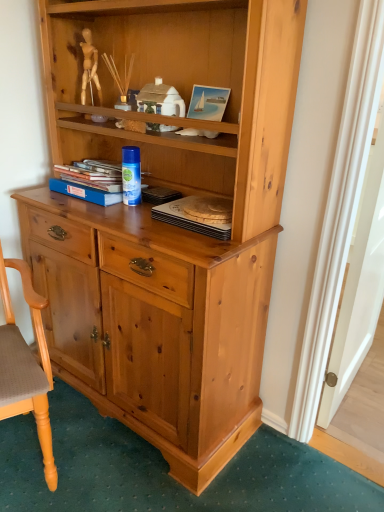
Measure the distance between blue hardcover book at center, which is the 1th book in left-to-right order, and camera.

blue hardcover book at center, which is the 1th book in left-to-right order, is 4.91 feet from camera.

Where is `wooden polished chair at lower left`? This screenshot has width=384, height=512. wooden polished chair at lower left is located at coordinates (26, 366).

Is wooden polished chair at lower left positioned beyond the bounds of blue hardcover book at center, which is the 1th book in left-to-right order?

Indeed, wooden polished chair at lower left is completely outside blue hardcover book at center, which is the 1th book in left-to-right order.

How many degrees apart are the facing directions of wooden polished chair at lower left and blue hardcover book at center, which is the 1th book in left-to-right order?

The angle between the facing direction of wooden polished chair at lower left and the facing direction of blue hardcover book at center, which is the 1th book in left-to-right order, is 68.4 degrees.

Is wooden polished chair at lower left not close to blue hardcover book at center, the 2th book positioned from the right?

No, wooden polished chair at lower left is not far away from blue hardcover book at center, the 2th book positioned from the right.

Considering the sizes of objects wooden polished chair at lower left and blue hardcover book at center, which is the 1th book in left-to-right order, in the image provided, who is wider, wooden polished chair at lower left or blue hardcover book at center, which is the 1th book in left-to-right order,?

wooden polished chair at lower left.

Which of these two, blue hardcover book at center, which is the 1th book in left-to-right order, or wooden round tray at center, the 1th book viewed from the right, stands taller?

blue hardcover book at center, which is the 1th book in left-to-right order.

From a real-world perspective, is blue hardcover book at center, which is the 1th book in left-to-right order, positioned under wooden round tray at center, the second book positioned from the left, based on gravity?

No, from a real-world perspective, blue hardcover book at center, which is the 1th book in left-to-right order, is not below wooden round tray at center, the second book positioned from the left.

Can you tell me how much blue hardcover book at center, the 2th book positioned from the right, and wooden round tray at center, the 1th book viewed from the right, differ in facing direction?

The angle between the facing direction of blue hardcover book at center, the 2th book positioned from the right, and the facing direction of wooden round tray at center, the 1th book viewed from the right, is 0.000216 degrees.

Between point (197, 221) and point (66, 188), which one is positioned behind?

Positioned behind is point (66, 188).

Is blue hardcover book at center, which is the 1th book in left-to-right order, completely or partially inside wooden round tray at center, the 1th book viewed from the right?

That's incorrect, blue hardcover book at center, which is the 1th book in left-to-right order, is not inside wooden round tray at center, the 1th book viewed from the right.

Considering the sizes of objects wooden round tray at center, the 1th book viewed from the right, and blue hardcover book at center, which is the 1th book in left-to-right order, in the image provided, who is bigger, wooden round tray at center, the 1th book viewed from the right, or blue hardcover book at center, which is the 1th book in left-to-right order,?

blue hardcover book at center, which is the 1th book in left-to-right order, is bigger.

The image size is (384, 512). Identify the location of book below the blue hardcover book at center, which is the 1th book in left-to-right order (from a real-world perspective). (189, 220).

From the image's perspective, relative to wooden polished chair at lower left, is wooden round tray at center, the second book positioned from the left, above or below?

Based on their image positions, wooden round tray at center, the second book positioned from the left, is located above wooden polished chair at lower left.

Based on the photo, considering the relative sizes of wooden round tray at center, the second book positioned from the left, and wooden polished chair at lower left in the image provided, is wooden round tray at center, the second book positioned from the left, taller than wooden polished chair at lower left?

No.

How different are the orientations of wooden round tray at center, the second book positioned from the left, and wooden polished chair at lower left in degrees?

The angular difference between wooden round tray at center, the second book positioned from the left, and wooden polished chair at lower left is 68.4 degrees.

From the image's perspective, which one is positioned lower, blue hardcover book at center, the 2th book positioned from the right, or wooden polished chair at lower left?

wooden polished chair at lower left.

Is blue hardcover book at center, which is the 1th book in left-to-right order, aimed at wooden polished chair at lower left?

Yes, blue hardcover book at center, which is the 1th book in left-to-right order, faces towards wooden polished chair at lower left.

Is wooden polished chair at lower left completely or partially inside blue hardcover book at center, the 2th book positioned from the right?

No.

Consider the image. From a real-world perspective, is wooden polished chair at lower left below wooden round tray at center, the second book positioned from the left?

Correct, in the physical world, wooden polished chair at lower left is lower than wooden round tray at center, the second book positioned from the left.

From the image's perspective, between wooden polished chair at lower left and wooden round tray at center, the second book positioned from the left, which one is located above?

wooden round tray at center, the second book positioned from the left, from the image's perspective.

Is wooden polished chair at lower left not near wooden round tray at center, the 1th book viewed from the right?

wooden polished chair at lower left is near wooden round tray at center, the 1th book viewed from the right, not far away.

Is wooden polished chair at lower left in front of or behind wooden round tray at center, the 1th book viewed from the right, in the image?

Visually, wooden polished chair at lower left is located in front of wooden round tray at center, the 1th book viewed from the right.

From a real-world perspective, which book is the 2nd one above the wooden polished chair at lower left? Please provide its 2D coordinates.

[(90, 181)]

At what (x,y) coordinates should I click in order to perform the action: click on book that is under the blue hardcover book at center, which is the 1th book in left-to-right order (from a real-world perspective). Please return your answer as a coordinate pair (x, y). The image size is (384, 512). Looking at the image, I should click on (x=189, y=220).

From the image, which object appears to be nearer to wooden polished chair at lower left, blue hardcover book at center, which is the 1th book in left-to-right order, or wooden round tray at center, the second book positioned from the left?

Among the two, blue hardcover book at center, which is the 1th book in left-to-right order, is located nearer to wooden polished chair at lower left.

Based on their spatial positions, is wooden round tray at center, the second book positioned from the left, or wooden polished chair at lower left closer to blue hardcover book at center, the 2th book positioned from the right?

wooden round tray at center, the second book positioned from the left, lies closer to blue hardcover book at center, the 2th book positioned from the right, than the other object.

Looking at the image, which one is located closer to wooden polished chair at lower left, wooden round tray at center, the 1th book viewed from the right, or blue hardcover book at center, which is the 1th book in left-to-right order?

Based on the image, blue hardcover book at center, which is the 1th book in left-to-right order, appears to be nearer to wooden polished chair at lower left.

From the image, which object appears to be farther from wooden round tray at center, the second book positioned from the left, wooden polished chair at lower left or blue hardcover book at center, which is the 1th book in left-to-right order?

wooden polished chair at lower left lies further to wooden round tray at center, the second book positioned from the left, than the other object.

Estimate the real-world distances between objects in this image. Which object is closer to blue hardcover book at center, the 2th book positioned from the right, wooden polished chair at lower left or wooden round tray at center, the second book positioned from the left?

Among the two, wooden round tray at center, the second book positioned from the left, is located nearer to blue hardcover book at center, the 2th book positioned from the right.

Looking at the image, which one is located further to wooden round tray at center, the second book positioned from the left, blue hardcover book at center, which is the 1th book in left-to-right order, or wooden polished chair at lower left?

wooden polished chair at lower left is further to wooden round tray at center, the second book positioned from the left.

Where is `book between blue hardcover book at center, the 2th book positioned from the right, and wooden polished chair at lower left, in the vertical direction`? book between blue hardcover book at center, the 2th book positioned from the right, and wooden polished chair at lower left, in the vertical direction is located at coordinates (189, 220).